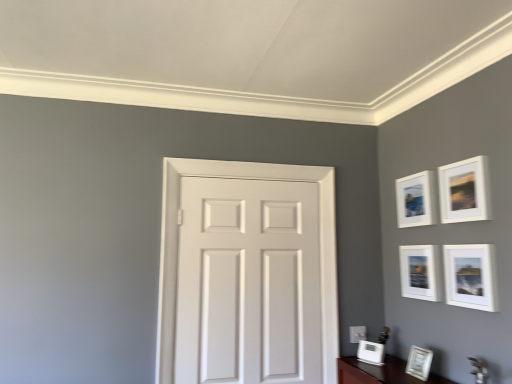
Question: Is white matte picture frame at upper right, which is counted as the 3th picture frame, starting from the bottom, positioned far away from matte white picture frame at upper right, which ranks as the second picture frame in top-to-bottom order?

Choices:
 (A) no
 (B) yes

Answer: (A)

Question: Does white matte picture frame at upper right, the 4th picture frame in the top-to-bottom sequence, appear on the left side of matte white picture frame at upper right, the 5th picture frame positioned from the bottom?

Choices:
 (A) no
 (B) yes

Answer: (B)

Question: From a real-world perspective, is white matte picture frame at upper right, which is counted as the 3th picture frame, starting from the bottom, on matte white picture frame at upper right, which ranks as the second picture frame in top-to-bottom order?

Choices:
 (A) no
 (B) yes

Answer: (A)

Question: From the image's perspective, is white matte picture frame at upper right, which is counted as the 3th picture frame, starting from the bottom, located beneath matte white picture frame at upper right, the 5th picture frame positioned from the bottom?

Choices:
 (A) no
 (B) yes

Answer: (B)

Question: From the image's perspective, is white matte picture frame at upper right, which is counted as the 3th picture frame, starting from the bottom, on matte white picture frame at upper right, which ranks as the second picture frame in top-to-bottom order?

Choices:
 (A) yes
 (B) no

Answer: (B)

Question: Does white matte picture frame at upper right, the 4th picture frame in the top-to-bottom sequence, have a lesser width compared to matte white picture frame at upper right, which ranks as the second picture frame in top-to-bottom order?

Choices:
 (A) no
 (B) yes

Answer: (A)

Question: Does white glossy picture frame at lower right, which ranks as the first picture frame in bottom-to-top order, appear on the left side of white glossy picture frame at lower right, which is the second picture frame in bottom-to-top order?

Choices:
 (A) no
 (B) yes

Answer: (B)

Question: From the image's perspective, is white glossy picture frame at lower right, which ranks as the first picture frame in bottom-to-top order, on top of white glossy picture frame at lower right, which is the second picture frame in bottom-to-top order?

Choices:
 (A) yes
 (B) no

Answer: (B)

Question: From the image's perspective, would you say white glossy picture frame at lower right, the sixth picture frame when ordered from top to bottom, is shown under white glossy picture frame at lower right, the fifth picture frame in the top-to-bottom sequence?

Choices:
 (A) yes
 (B) no

Answer: (A)

Question: Can you confirm if white glossy picture frame at lower right, which ranks as the first picture frame in bottom-to-top order, is shorter than white glossy picture frame at lower right, the fifth picture frame in the top-to-bottom sequence?

Choices:
 (A) yes
 (B) no

Answer: (A)

Question: Considering the relative sizes of white glossy picture frame at lower right, which ranks as the first picture frame in bottom-to-top order, and white glossy picture frame at lower right, the fifth picture frame in the top-to-bottom sequence, in the image provided, is white glossy picture frame at lower right, which ranks as the first picture frame in bottom-to-top order, wider than white glossy picture frame at lower right, the fifth picture frame in the top-to-bottom sequence,?

Choices:
 (A) no
 (B) yes

Answer: (A)

Question: From a real-world perspective, is white glossy picture frame at lower right, the sixth picture frame when ordered from top to bottom, over white glossy picture frame at lower right, the fifth picture frame in the top-to-bottom sequence?

Choices:
 (A) no
 (B) yes

Answer: (A)

Question: From a real-world perspective, is white glossy picture frame at lower right, which is the second picture frame in bottom-to-top order, physically below white matte door at center?

Choices:
 (A) yes
 (B) no

Answer: (A)